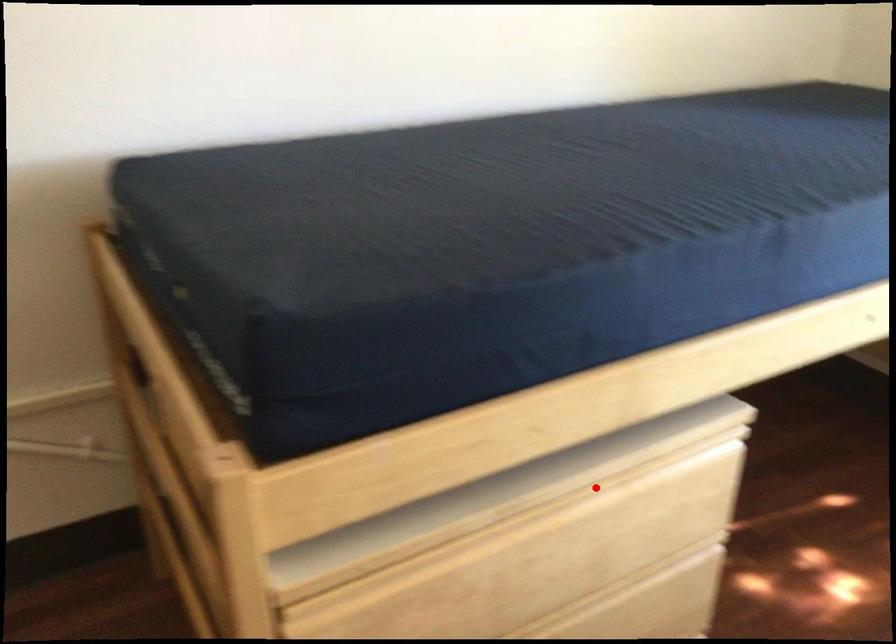
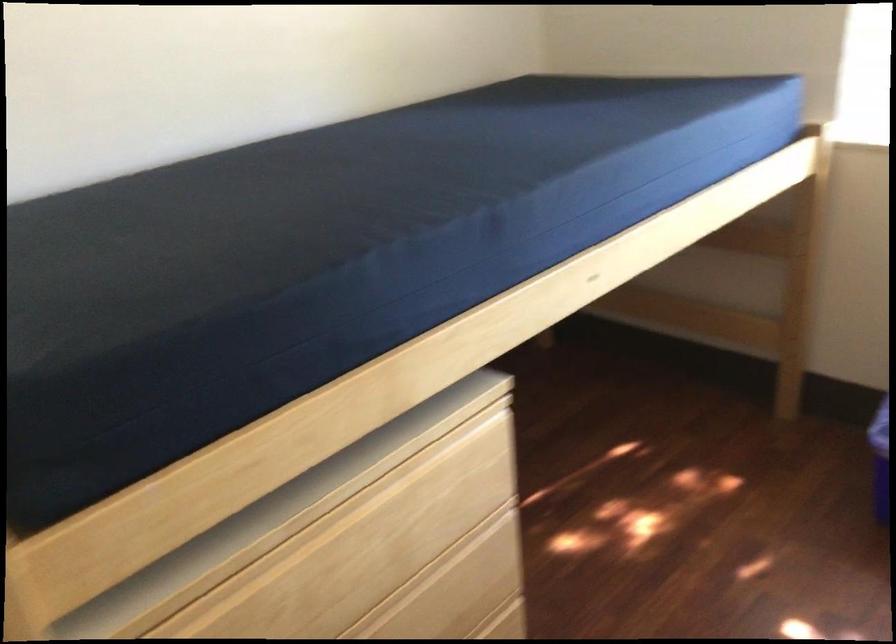
Find the pixel in the second image that matches the highlighted location in the first image.

(383, 478)